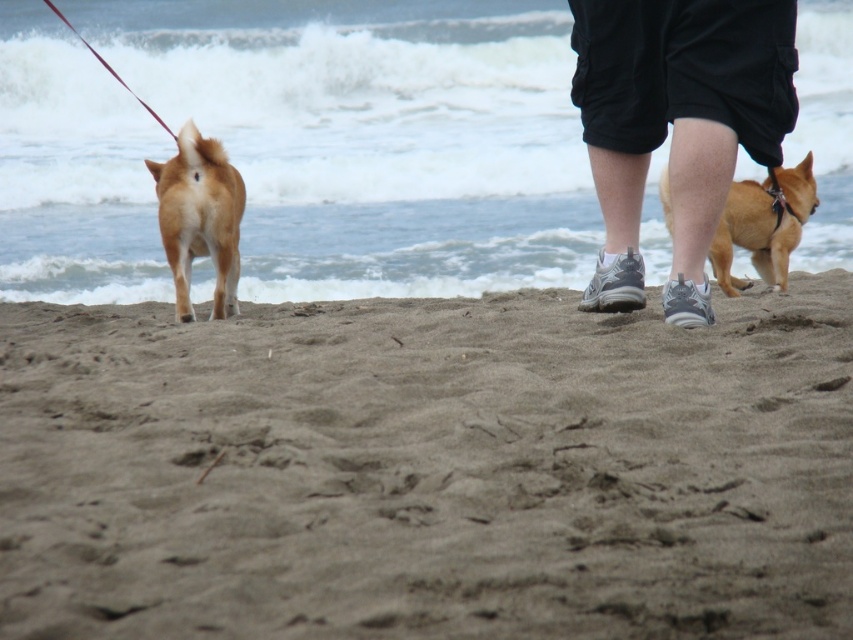
Is black cotton shorts at center to the left of golden fur dog at right from the viewer's perspective?

Yes, black cotton shorts at center is to the left of golden fur dog at right.

Looking at this image, who is more distant from viewer, (786, 65) or (756, 260)?

The point (756, 260) is more distant.

Locate an element on the screen. black cotton shorts at center is located at coordinates (676, 124).

Can you confirm if brown sandy beach at lower center is thinner than golden fur dog at center?

No.

Measure the distance from brown sandy beach at lower center to golden fur dog at center.

brown sandy beach at lower center is 4.85 feet away from golden fur dog at center.

This screenshot has height=640, width=853. Identify the location of brown sandy beach at lower center. (428, 470).

Find the location of a particular element. The height and width of the screenshot is (640, 853). brown sandy beach at lower center is located at coordinates point(428,470).

Does point (215, 484) lie in front of point (781, 166)?

That is True.

Who is shorter, brown sandy beach at lower center or golden fur dog at right?

brown sandy beach at lower center is shorter.

Which is behind, point (368, 592) or point (793, 208)?

Positioned behind is point (793, 208).

At what (x,y) coordinates should I click in order to perform the action: click on brown sandy beach at lower center. Please return your answer as a coordinate pair (x, y). This screenshot has height=640, width=853. Looking at the image, I should click on (428, 470).